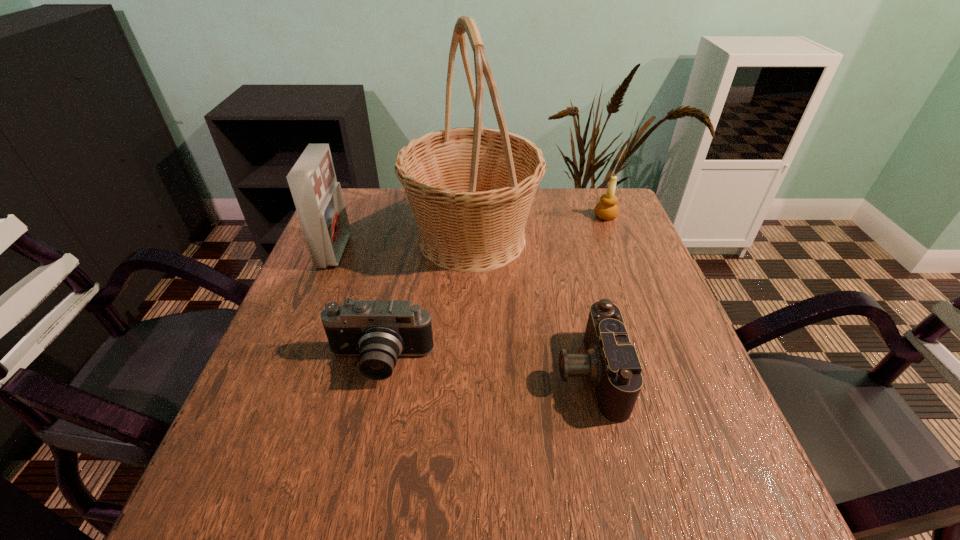
The width and height of the screenshot is (960, 540). I want to click on vacant space located on the front-facing side of the left camera, so click(353, 490).

Locate an element on the screen. free location located 0.220m on the front-facing side of the shortest object is located at coordinates (443, 374).

You are a GUI agent. You are given a task and a screenshot of the screen. Output one action in this format:
    pyautogui.click(x=<x>, y=<y>)
    Task: Click on the vacant space situated on the front-facing side of the shortest object
    The height and width of the screenshot is (540, 960).
    Given the screenshot: What is the action you would take?
    pyautogui.click(x=479, y=374)

Where is `blank space located on the front-facing side of the shortest object`? This screenshot has height=540, width=960. blank space located on the front-facing side of the shortest object is located at coordinates (386, 374).

The height and width of the screenshot is (540, 960). What are the coordinates of `basket located in the far edge section of the desktop` in the screenshot? It's located at (470, 189).

What are the coordinates of `candle_holder located at the far edge` in the screenshot? It's located at (607, 209).

Identify the location of the first-aid kit that is positioned at the left edge. The width and height of the screenshot is (960, 540). pos(318,198).

What are the coordinates of `camera at the left edge` in the screenshot? It's located at (378, 332).

The height and width of the screenshot is (540, 960). Identify the location of candle_holder present at the right edge. (607, 209).

Where is `camera that is at the right edge`? This screenshot has height=540, width=960. camera that is at the right edge is located at coordinates (611, 364).